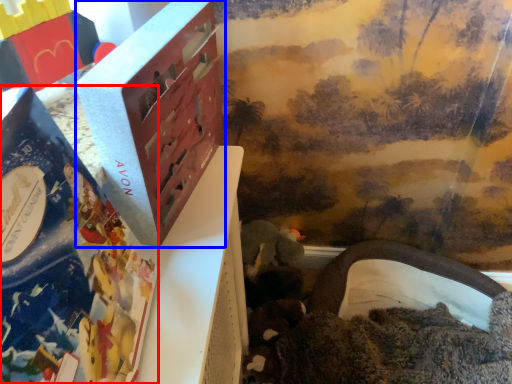
Question: Which object is closer to the camera taking this photo, book (highlighted by a red box) or box (highlighted by a blue box)?

Choices:
 (A) book
 (B) box

Answer: (A)